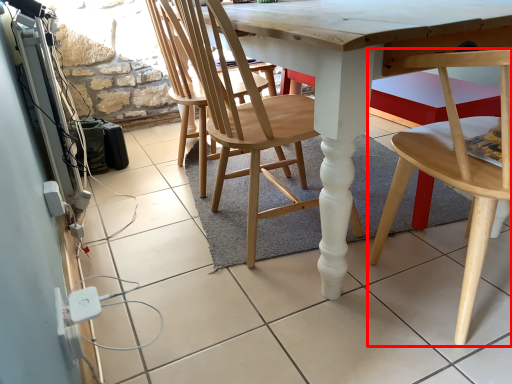
Question: Where is chair (annotated by the red box) located in relation to chair in the image?

Choices:
 (A) right
 (B) left

Answer: (A)